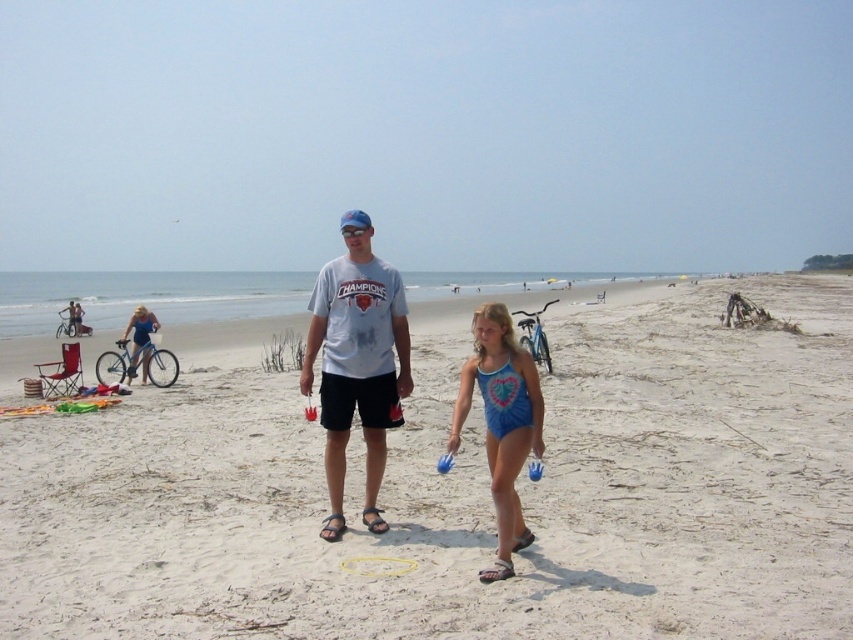
Question: Which object appears closest to the camera in this image?

Choices:
 (A) blue swimsuit at center
 (B) white sandy beach at center
 (C) light gray t-shirt at center

Answer: (B)

Question: Can you confirm if blue fabric bikini at left is positioned to the left of black rubber sandal at center?

Choices:
 (A) no
 (B) yes

Answer: (B)

Question: Can you confirm if blue fabric bikini at left is positioned below white rubber sandal at lower center?

Choices:
 (A) no
 (B) yes

Answer: (A)

Question: Which of these objects is positioned closest to the blue fabric bikini at left?

Choices:
 (A) white rubber sandal at lower center
 (B) blue swimsuit at center

Answer: (A)

Question: Does blue fabric bikini at left have a smaller size compared to white rubber sandal at lower center?

Choices:
 (A) no
 (B) yes

Answer: (A)

Question: Which point is closer to the camera taking this photo?

Choices:
 (A) (328, 520)
 (B) (136, 332)
 (C) (329, 317)

Answer: (A)